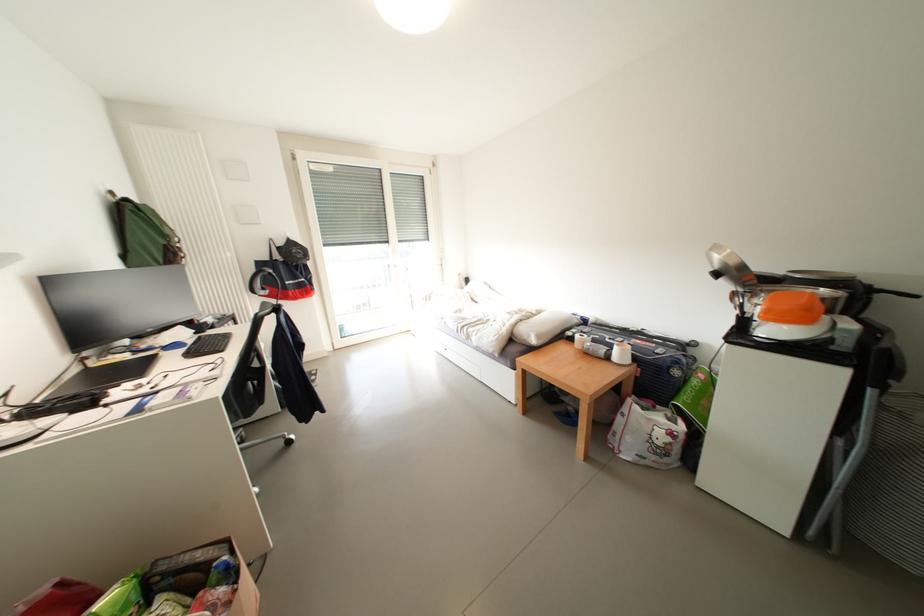
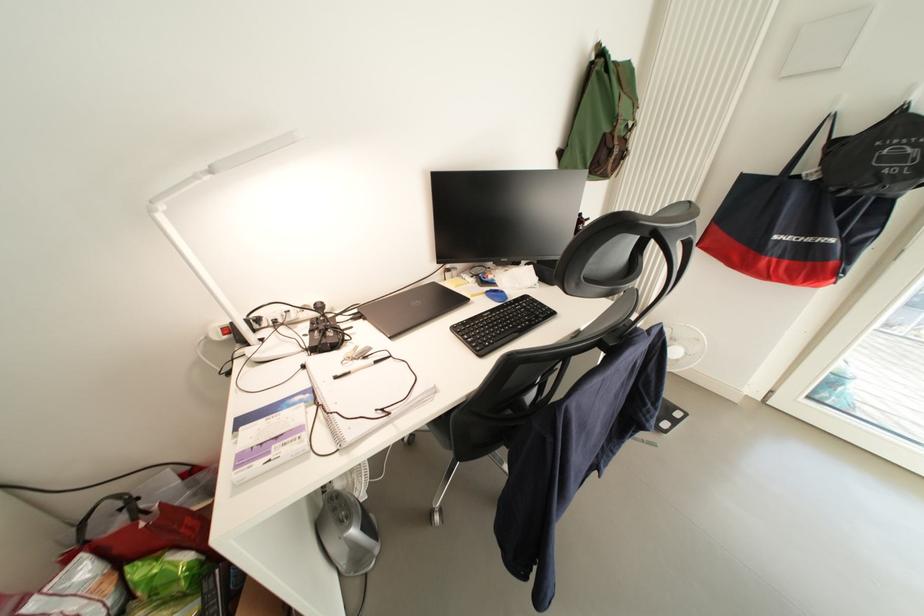
Find the pixel in the second image that matches [321,381] in the first image.

(673, 428)